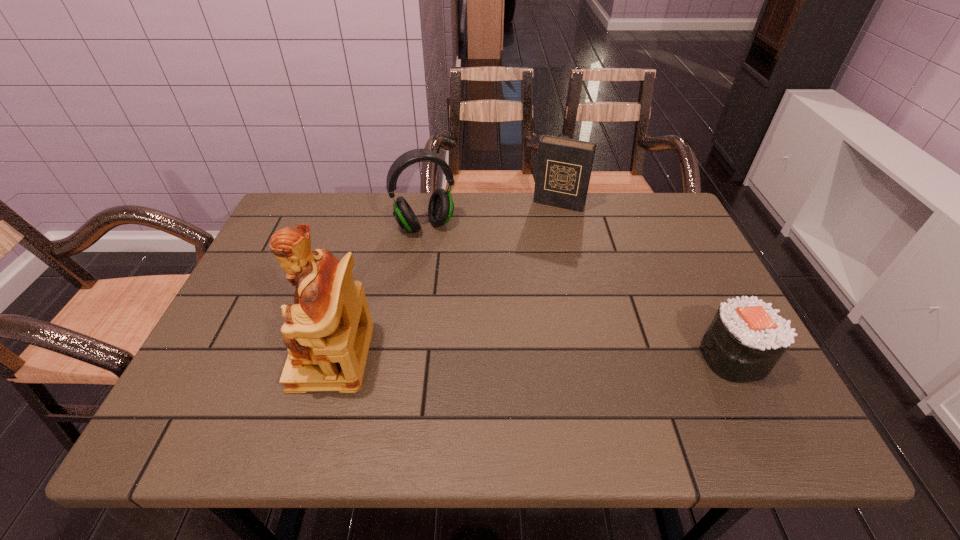
You are a GUI agent. You are given a task and a screenshot of the screen. Output one action in this format:
    pyautogui.click(x=<x>, y=<y>)
    Task: Click on the free space on the desktop that is between the figurine and the shortest object and is positioned on the ear cups of the headset
    This screenshot has height=540, width=960.
    Given the screenshot: What is the action you would take?
    pyautogui.click(x=489, y=356)

This screenshot has width=960, height=540. Find the location of `free spot on the desktop that is between the tallest object and the shortest object and is positioned on the front cover of the second object from right to left`. free spot on the desktop that is between the tallest object and the shortest object and is positioned on the front cover of the second object from right to left is located at coordinates 494,356.